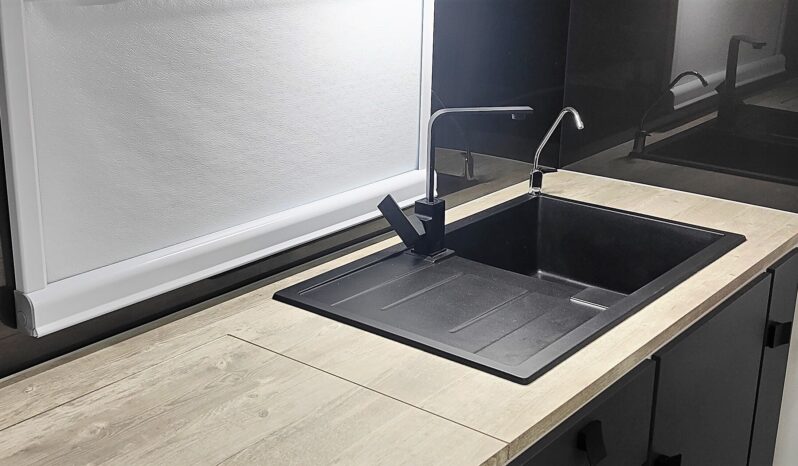
The width and height of the screenshot is (798, 466). Identify the location of soap dispenser. (536, 171).